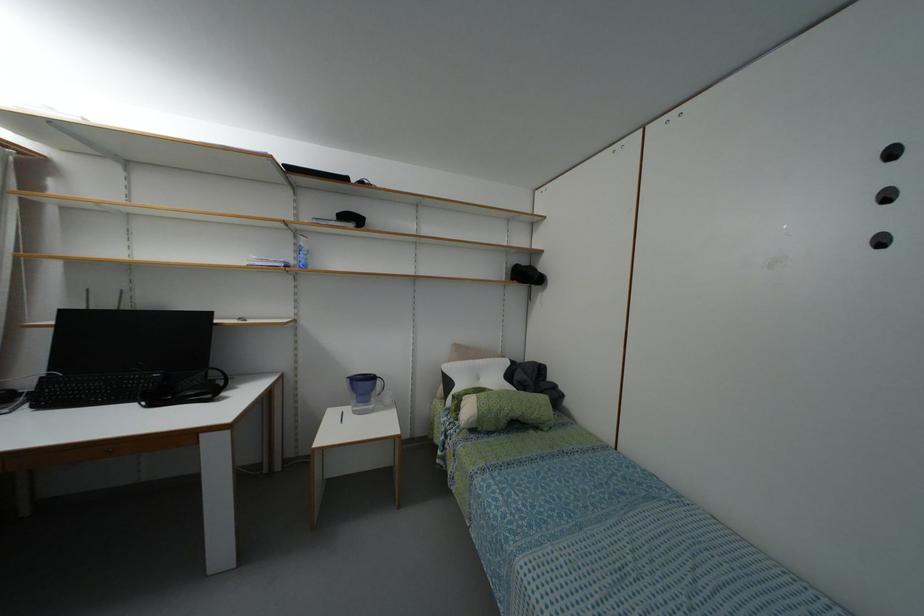
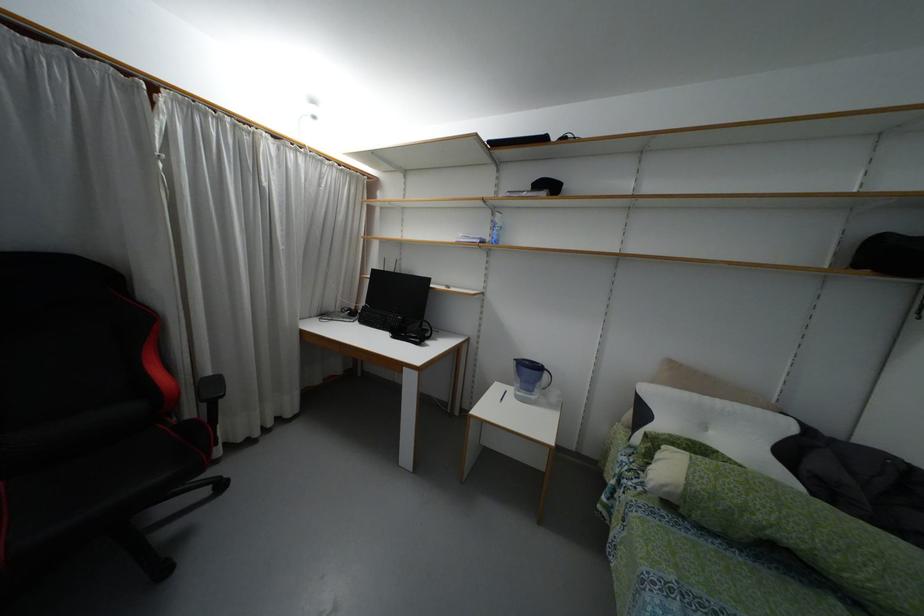
Find the pixel in the second image that matches (478,410) in the first image.

(687, 483)